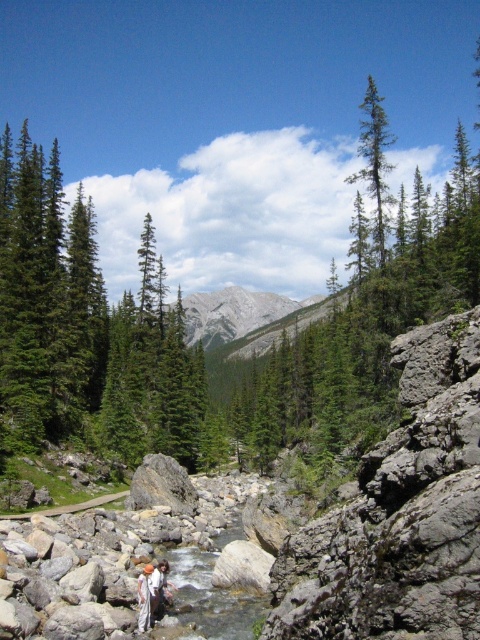
Question: Which is nearer to the white cotton clothing at center?

Choices:
 (A) white cotton shirt at center
 (B) green matte tree at center

Answer: (A)

Question: Which is farther from the green matte tree at center?

Choices:
 (A) white cotton clothing at center
 (B) white cotton shirt at center

Answer: (B)

Question: Can you confirm if green matte tree at center is positioned above white cotton shirt at center?

Choices:
 (A) no
 (B) yes

Answer: (B)

Question: Can you confirm if green matte evergreen tree at upper right is bigger than white cotton shirt at center?

Choices:
 (A) no
 (B) yes

Answer: (B)

Question: Does green matte tree at center have a lesser width compared to white cotton clothing at center?

Choices:
 (A) yes
 (B) no

Answer: (B)

Question: Estimate the real-world distances between objects in this image. Which object is closer to the white cotton clothing at center?

Choices:
 (A) green matte tree at center
 (B) white cotton shirt at center
 (C) green matte evergreen tree at upper right

Answer: (B)